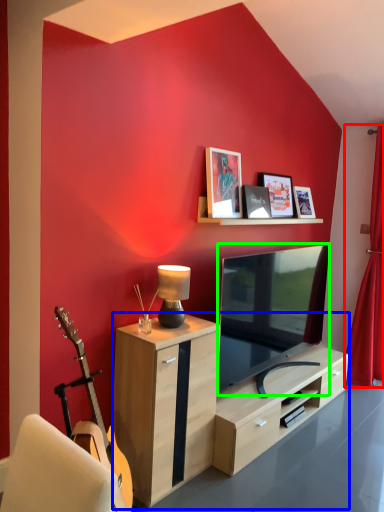
Question: Estimate the real-world distances between objects in this image. Which object is closer to curtain (highlighted by a red box), desk (highlighted by a blue box) or television (highlighted by a green box)?

Choices:
 (A) desk
 (B) television

Answer: (B)